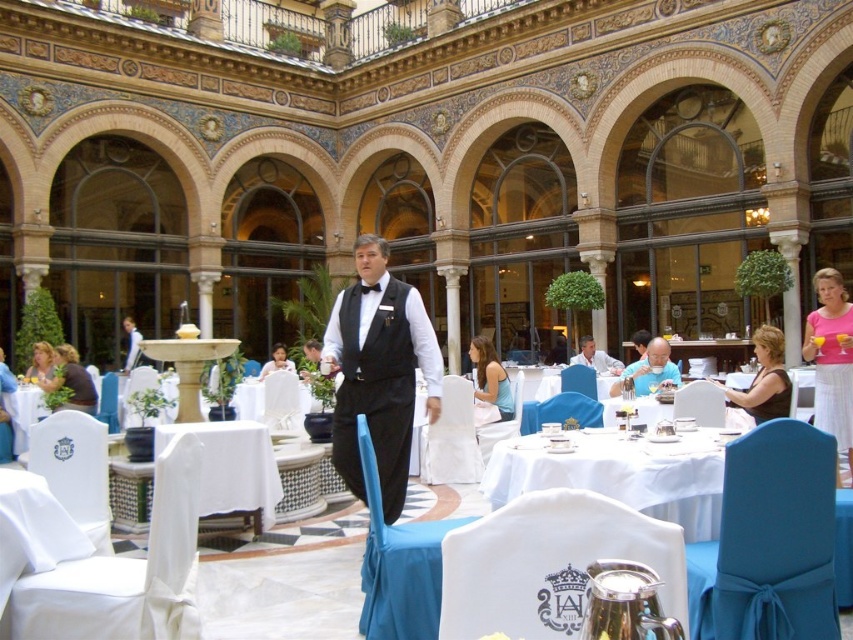
You are a guest at this upscale dining area and want to place your matte black shirt at lower left on the white cloth at center. Can you do this without moving any other items?

The white cloth at center is closer to the viewer than the matte black shirt at lower left, so you can easily place the matte black shirt at lower left onto the white cloth at center without needing to move other items.